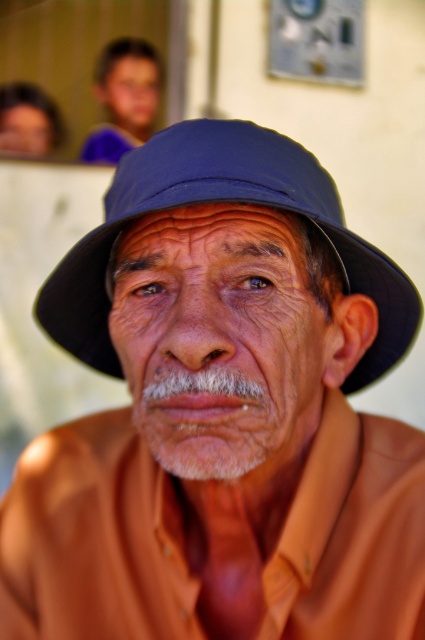
Question: Which object appears farthest from the camera in this image?

Choices:
 (A) blue fabric fedora at center
 (B) blue fabric hat at upper center

Answer: (B)

Question: Does blue fabric fedora at center appear under blue fabric hat at upper center?

Choices:
 (A) no
 (B) yes

Answer: (B)

Question: Which point is farther to the camera?

Choices:
 (A) blue fabric hat at upper center
 (B) blue fabric fedora at center

Answer: (A)

Question: Can you confirm if blue fabric fedora at center is thinner than blue fabric hat at upper center?

Choices:
 (A) yes
 (B) no

Answer: (A)

Question: Can you confirm if blue fabric fedora at center is positioned below blue fabric hat at upper center?

Choices:
 (A) no
 (B) yes

Answer: (B)

Question: Among these points, which one is farthest from the camera?

Choices:
 (A) (115, 211)
 (B) (147, 45)

Answer: (B)